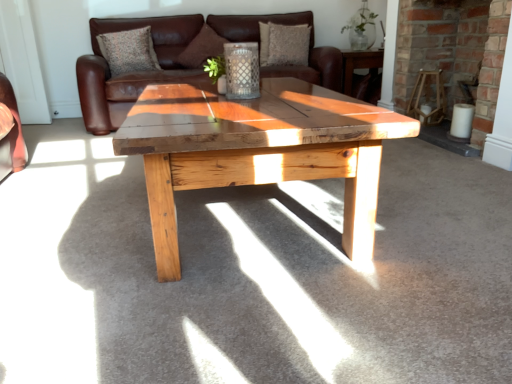
Describe the element at coordinates (202, 48) in the screenshot. I see `brown suede pillow at center, positioned as the second pillow in left-to-right order` at that location.

Measure the distance between brick fireplace at center and camera.

9.16 feet.

Measure the distance between point (80, 60) and camera.

A distance of 3.24 meters exists between point (80, 60) and camera.

Locate an element on the screen. This screenshot has height=384, width=512. textured brown pillow at upper center, marked as the third pillow in a left-to-right arrangement is located at coordinates (284, 44).

At what (x,y) coordinates should I click in order to perform the action: click on brown suede pillow at center, positioned as the second pillow in left-to-right order. Please return your answer as a coordinate pair (x, y). The height and width of the screenshot is (384, 512). Looking at the image, I should click on (202, 48).

From a real-world perspective, is brick fireplace at center over wooden chair at right?

Yes, from a real-world perspective, brick fireplace at center is on top of wooden chair at right.

Looking at this image, considering the sizes of objects brick fireplace at center and wooden chair at right in the image provided, who is smaller, brick fireplace at center or wooden chair at right?

wooden chair at right.

From the image's perspective, who appears lower, brick fireplace at center or wooden chair at right?

wooden chair at right, from the image's perspective.

From the image's perspective, is brown leather couch at center positioned above or below brown suede pillow at center, positioned as the second pillow in left-to-right order?

brown leather couch at center is situated lower than brown suede pillow at center, positioned as the second pillow in left-to-right order, in the image.

Is brown leather couch at center in front of or behind brown suede pillow at center, positioned as the second pillow in left-to-right order, in the image?

Clearly, brown leather couch at center is in front of brown suede pillow at center, positioned as the second pillow in left-to-right order.

In the scene shown: Is brown leather couch at center situated inside brown suede pillow at center, positioned as the second pillow in left-to-right order, or outside?

brown leather couch at center is not enclosed by brown suede pillow at center, positioned as the second pillow in left-to-right order.

Based on the photo, could you measure the distance between brown leather couch at center and brown suede pillow at center, which is the second pillow in right-to-left order?

The distance of brown leather couch at center from brown suede pillow at center, which is the second pillow in right-to-left order, is 15.57 inches.

From the image's perspective, is brick fireplace at center above brown suede pillow at center, positioned as the second pillow in left-to-right order?

No, from the image's perspective, brick fireplace at center is not on top of brown suede pillow at center, positioned as the second pillow in left-to-right order.

Which point is more forward, (489,112) or (190,42)?

Point (489,112)

Is brick fireplace at center facing towards brown suede pillow at center, which is the second pillow in right-to-left order?

No.

From a real-world perspective, is brick fireplace at center physically located above or below brown suede pillow at center, positioned as the second pillow in left-to-right order?

Clearly, from a real-world perspective, brick fireplace at center is below brown suede pillow at center, positioned as the second pillow in left-to-right order.

Considering the relative positions of textured brown pillow at upper center, marked as the third pillow in a left-to-right arrangement, and wooden chair at right in the image provided, is textured brown pillow at upper center, marked as the third pillow in a left-to-right arrangement, to the right of wooden chair at right from the viewer's perspective?

Incorrect, textured brown pillow at upper center, marked as the third pillow in a left-to-right arrangement, is not on the right side of wooden chair at right.

From a real-world perspective, is textured brown pillow at upper center, marked as the third pillow in a left-to-right arrangement, positioned above or below wooden chair at right?

textured brown pillow at upper center, marked as the third pillow in a left-to-right arrangement, is situated higher than wooden chair at right in the real world.

Who is more distant, textured brown pillow at upper center, marked as the 1th pillow in a right-to-left arrangement, or wooden chair at right?

Positioned behind is textured brown pillow at upper center, marked as the 1th pillow in a right-to-left arrangement.

Who is more distant, brown suede pillow at center, positioned as the second pillow in left-to-right order, or wooden chair at right?

brown suede pillow at center, positioned as the second pillow in left-to-right order.

Where is `the 2nd pillow located above the wooden chair at right (from a real-world perspective)`? Image resolution: width=512 pixels, height=384 pixels. the 2nd pillow located above the wooden chair at right (from a real-world perspective) is located at coordinates (202, 48).

Between brown suede pillow at center, positioned as the second pillow in left-to-right order, and wooden chair at right, which one appears on the right side from the viewer's perspective?

Positioned to the right is wooden chair at right.

From the image's perspective, which one is positioned lower, brick fireplace at center or brown leather couch at center?

brick fireplace at center appears lower in the image.

From a real-world perspective, is brick fireplace at center below brown leather couch at center?

No, from a real-world perspective, brick fireplace at center is not under brown leather couch at center.

Is brick fireplace at center positioned beyond the bounds of brown leather couch at center?

Yes.

Do you think textured brown pillow at upper center, marked as the third pillow in a left-to-right arrangement, is within brick fireplace at center, or outside of it?

textured brown pillow at upper center, marked as the third pillow in a left-to-right arrangement, is located beyond the bounds of brick fireplace at center.

Based on the photo, is the surface of textured brown pillow at upper center, marked as the 1th pillow in a right-to-left arrangement, in direct contact with brick fireplace at center?

No, textured brown pillow at upper center, marked as the 1th pillow in a right-to-left arrangement, is not beside brick fireplace at center.

Between textured brown pillow at upper center, marked as the 1th pillow in a right-to-left arrangement, and brick fireplace at center, which one has more height?

brick fireplace at center is taller.

You are a GUI agent. You are given a task and a screenshot of the screen. Output one action in this format:
    pyautogui.click(x=<x>, y=<y>)
    Task: Click on the chair directly beneath the brick fireplace at center (from a real-world perspective)
    This screenshot has height=384, width=512.
    Given the screenshot: What is the action you would take?
    pyautogui.click(x=425, y=95)

Identify the location of studio couch below the brown suede pillow at center, which is the second pillow in right-to-left order (from the image's perspective). The height and width of the screenshot is (384, 512). (132, 73).

Which object lies further to the anchor point textured fabric pillow at upper center, which appears as the 3th pillow when viewed from the right, brown leather couch at center or textured brown pillow at upper center, marked as the 1th pillow in a right-to-left arrangement?

Based on the image, textured brown pillow at upper center, marked as the 1th pillow in a right-to-left arrangement, appears to be further to textured fabric pillow at upper center, which appears as the 3th pillow when viewed from the right.

From the picture: Estimate the real-world distances between objects in this image. Which object is closer to brick fireplace at center, brown leather couch at center or brown suede pillow at center, which is the second pillow in right-to-left order?

Based on the image, brown leather couch at center appears to be nearer to brick fireplace at center.

From the image, which object appears to be farther from textured fabric pillow at upper center, which appears as the 3th pillow when viewed from the right, wooden chair at right or brown suede pillow at center, which is the second pillow in right-to-left order?

Based on the image, wooden chair at right appears to be further to textured fabric pillow at upper center, which appears as the 3th pillow when viewed from the right.

Estimate the real-world distances between objects in this image. Which object is further from wooden chair at right, textured fabric pillow at upper center, which appears as the 3th pillow when viewed from the right, or brown suede pillow at center, positioned as the second pillow in left-to-right order?

Among the two, textured fabric pillow at upper center, which appears as the 3th pillow when viewed from the right, is located further to wooden chair at right.

Based on their spatial positions, is brown suede pillow at center, positioned as the second pillow in left-to-right order, or textured fabric pillow at upper center, which appears as the 3th pillow when viewed from the right, further from wooden chair at right?

Among the two, textured fabric pillow at upper center, which appears as the 3th pillow when viewed from the right, is located further to wooden chair at right.

Which object lies nearer to the anchor point brown leather couch at center, textured brown pillow at upper center, marked as the third pillow in a left-to-right arrangement, or wooden chair at right?

textured brown pillow at upper center, marked as the third pillow in a left-to-right arrangement.

Estimate the real-world distances between objects in this image. Which object is further from brick fireplace at center, brown leather couch at center or wooden chair at right?

brown leather couch at center.

Based on their spatial positions, is wooden chair at right or brown suede pillow at center, which is the second pillow in right-to-left order, further from brick fireplace at center?

Based on the image, brown suede pillow at center, which is the second pillow in right-to-left order, appears to be further to brick fireplace at center.

This screenshot has width=512, height=384. What are the coordinates of `pillow between brown leather couch at center and brick fireplace at center in the horizontal direction` in the screenshot? It's located at (284, 44).

Identify the location of pillow between brown leather couch at center and wooden chair at right. The image size is (512, 384). (284, 44).

This screenshot has height=384, width=512. Identify the location of studio couch between textured fabric pillow at upper center, the 1th pillow when ordered from left to right, and textured brown pillow at upper center, marked as the 1th pillow in a right-to-left arrangement, in the horizontal direction. (132, 73).

What are the coordinates of `chair between brick fireplace at center and textured brown pillow at upper center, marked as the third pillow in a left-to-right arrangement, from front to back` in the screenshot? It's located at (425, 95).